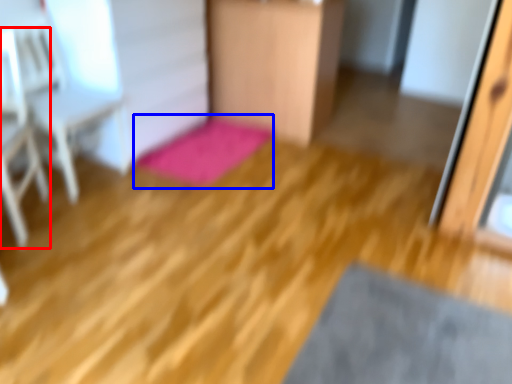
Question: Which object appears closest to the camera in this image, armchair (highlighted by a red box) or bath mat (highlighted by a blue box)?

Choices:
 (A) armchair
 (B) bath mat

Answer: (A)